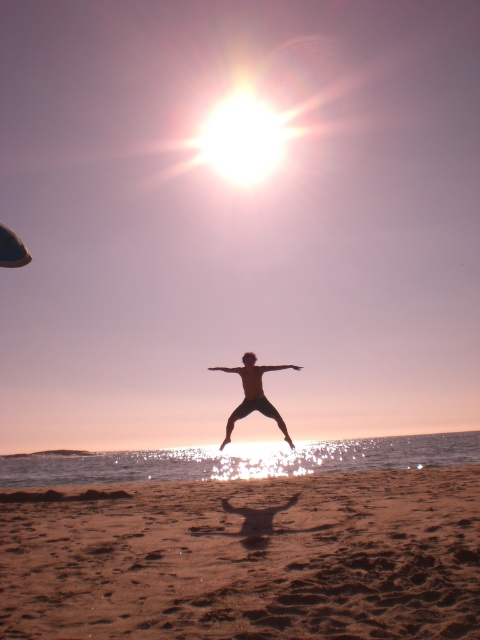
Question: Considering the relative positions of brown sandy beach at lower center and black matte person at center in the image provided, where is brown sandy beach at lower center located with respect to black matte person at center?

Choices:
 (A) left
 (B) right

Answer: (A)

Question: Can you confirm if brown sandy beach at lower center is positioned below black matte person at center?

Choices:
 (A) yes
 (B) no

Answer: (A)

Question: Which point is closer to the camera taking this photo?

Choices:
 (A) (242, 406)
 (B) (39, 612)

Answer: (B)

Question: Can you confirm if brown sandy beach at lower center is bigger than black matte person at center?

Choices:
 (A) yes
 (B) no

Answer: (A)

Question: Which object appears farthest from the camera in this image?

Choices:
 (A) black matte person at center
 (B) brown sandy beach at lower center

Answer: (A)